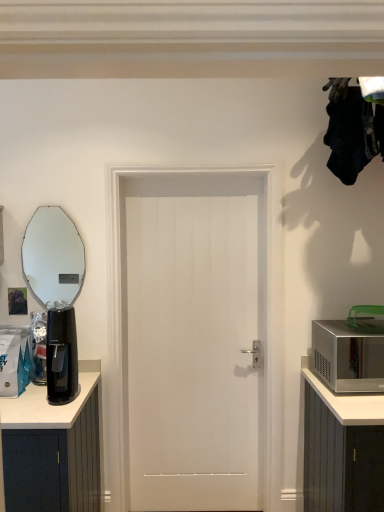
Question: From a real-world perspective, is black plastic coffee maker at left positioned over white smooth door at center based on gravity?

Choices:
 (A) yes
 (B) no

Answer: (A)

Question: Considering the relative sizes of black plastic coffee maker at left and white smooth door at center in the image provided, is black plastic coffee maker at left wider than white smooth door at center?

Choices:
 (A) yes
 (B) no

Answer: (A)

Question: From the image's perspective, is black plastic coffee maker at left beneath white smooth door at center?

Choices:
 (A) no
 (B) yes

Answer: (A)

Question: Is black plastic coffee maker at left in front of white smooth door at center?

Choices:
 (A) no
 (B) yes

Answer: (B)

Question: Is black plastic coffee maker at left to the right of white smooth door at center from the viewer's perspective?

Choices:
 (A) no
 (B) yes

Answer: (A)

Question: From the image's perspective, relative to white smooth door at center, is silver metallic microwave at right above or below?

Choices:
 (A) above
 (B) below

Answer: (B)

Question: Considering the positions of silver metallic microwave at right and white smooth door at center in the image, is silver metallic microwave at right bigger or smaller than white smooth door at center?

Choices:
 (A) small
 (B) big

Answer: (A)

Question: Is silver metallic microwave at right to the left or to the right of white smooth door at center in the image?

Choices:
 (A) left
 (B) right

Answer: (B)

Question: Considering the positions of silver metallic microwave at right and white smooth door at center in the image, is silver metallic microwave at right taller or shorter than white smooth door at center?

Choices:
 (A) short
 (B) tall

Answer: (A)

Question: In terms of size, does silver metallic microwave at right appear bigger or smaller than oval mirror at left?

Choices:
 (A) small
 (B) big

Answer: (B)

Question: From a real-world perspective, is silver metallic microwave at right above or below oval mirror at left?

Choices:
 (A) above
 (B) below

Answer: (B)

Question: Is silver metallic microwave at right taller or shorter than oval mirror at left?

Choices:
 (A) short
 (B) tall

Answer: (A)

Question: From the image's perspective, is silver metallic microwave at right above or below oval mirror at left?

Choices:
 (A) below
 (B) above

Answer: (A)

Question: Looking at their shapes, would you say black plastic coffee maker at left is wider or thinner than silver metallic microwave at right?

Choices:
 (A) wide
 (B) thin

Answer: (B)

Question: From a real-world perspective, relative to silver metallic microwave at right, is black plastic coffee maker at left vertically above or below?

Choices:
 (A) above
 (B) below

Answer: (A)